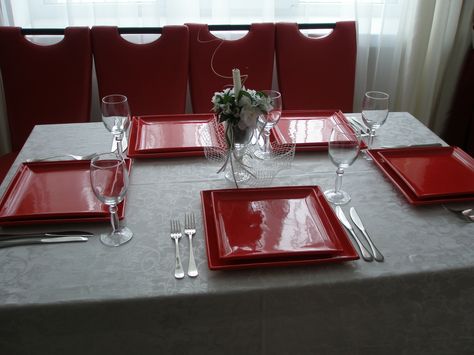
Image resolution: width=474 pixels, height=355 pixels. Find the location of `chairs`. chairs is located at coordinates (27, 80), (116, 84), (217, 68), (319, 81).